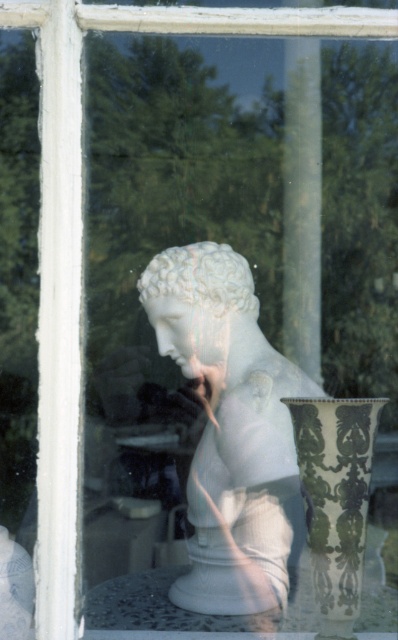
Is point (251, 465) less distant than point (360, 484)?

That is False.

Between white marble bust at center and green and white ceramic vase at center, which one appears on the left side from the viewer's perspective?

Positioned to the left is white marble bust at center.

Is point (214, 424) positioned in front of point (304, 442)?

No, it is not.

The height and width of the screenshot is (640, 398). Find the location of `white marble bust at center`. white marble bust at center is located at coordinates (228, 428).

Locate an element on the screen. white marble bust at center is located at coordinates (228, 428).

Does white marble bust at center have a greater height compared to white marble vase at lower center?

Indeed, white marble bust at center has a greater height compared to white marble vase at lower center.

Which is in front, point (224, 326) or point (136, 586)?

Point (224, 326) is more forward.

Locate an element on the screen. white marble bust at center is located at coordinates (228, 428).

Who is more distant from viewer, (327, 481) or (101, 596)?

The point (101, 596) is behind.

Between point (360, 552) and point (222, 621), which one is positioned in front?

Point (360, 552)

The image size is (398, 640). What are the coordinates of `green and white ceramic vase at center` in the screenshot? It's located at (335, 499).